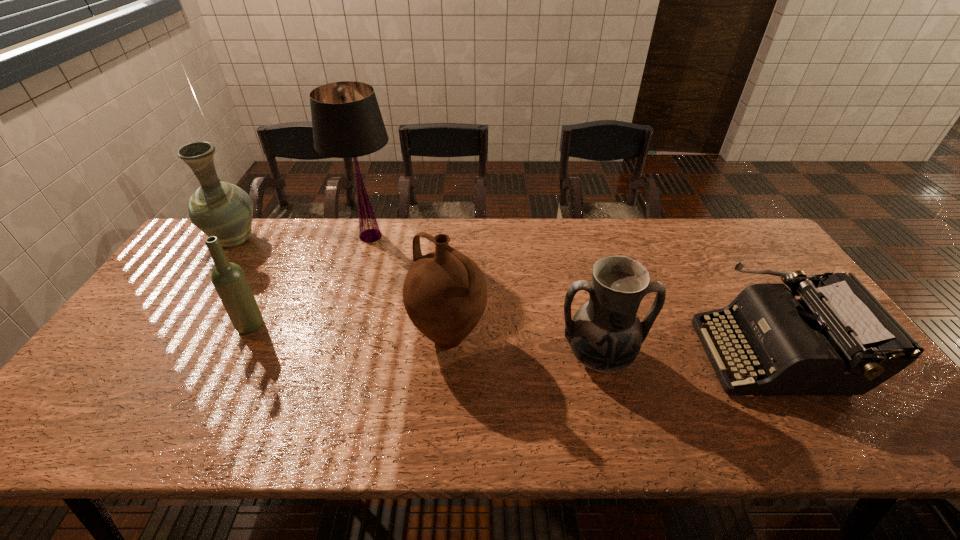
The height and width of the screenshot is (540, 960). Identify the location of object present at the right edge. (837, 339).

Locate an element on the screen. object present at the far left corner is located at coordinates coord(217,208).

This screenshot has width=960, height=540. Find the location of `object positioned at the near right corner`. object positioned at the near right corner is located at coordinates (837, 339).

Image resolution: width=960 pixels, height=540 pixels. In the image, there is a desktop. Identify the location of free region at the far edge. (331, 233).

Identify the location of free spot at the near edge of the desktop. This screenshot has height=540, width=960. (194, 414).

Find the location of a particular element. Image resolution: width=960 pixels, height=540 pixels. free space at the left edge of the desktop is located at coordinates (169, 300).

The width and height of the screenshot is (960, 540). In the image, there is a desktop. Find the location of `vacant space at the far left corner`. vacant space at the far left corner is located at coordinates (201, 252).

Identify the location of free space at the far right corner of the desktop. The width and height of the screenshot is (960, 540). (721, 218).

Where is `blank space at the near right corner of the desktop`? The image size is (960, 540). blank space at the near right corner of the desktop is located at coordinates (851, 416).

Locate an element on the screen. free space between the third object from right to left and the rightmost pitcher is located at coordinates (523, 347).